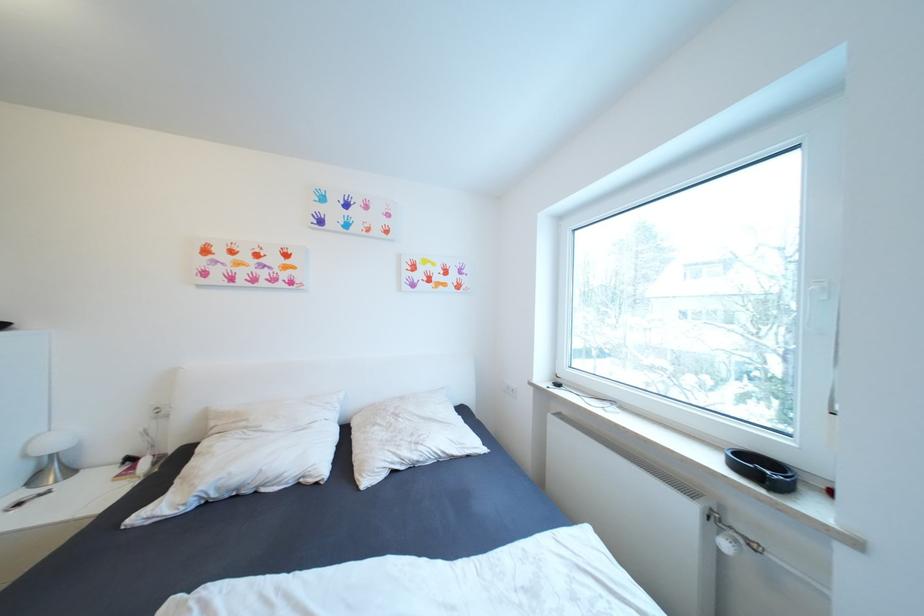
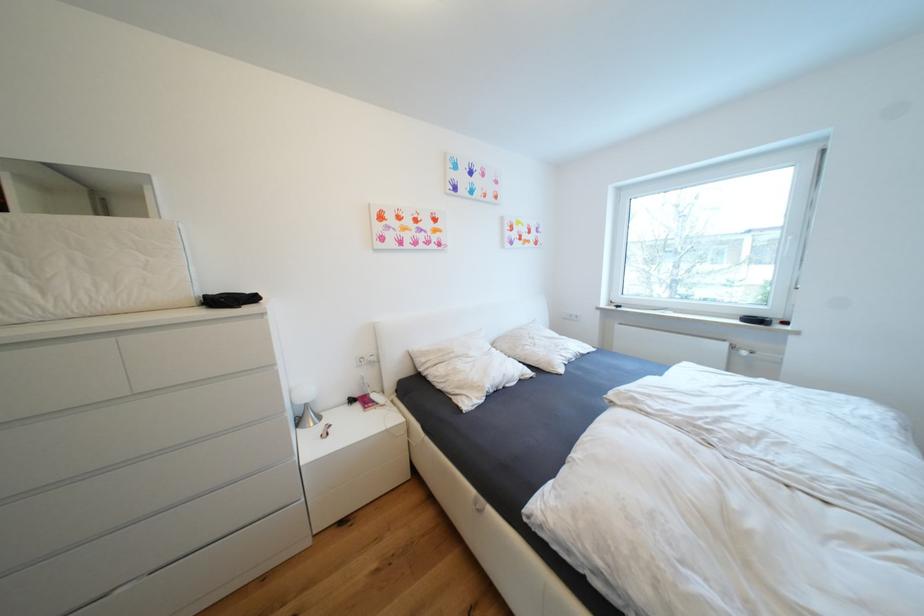
Question: Which direction would the cameraman need to move to produce the second image? Reply with the corresponding letter.

Choices:
 (A) Left
 (B) Right
 (C) Forward
 (D) Backward

Answer: (A)